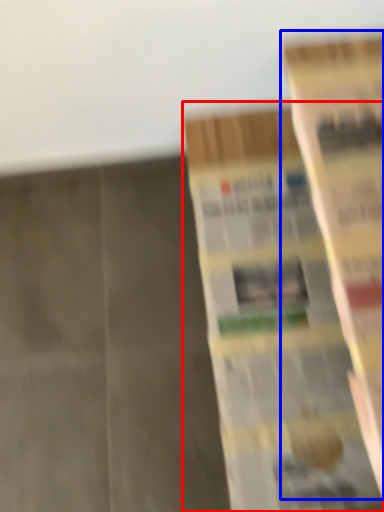
Question: Which object appears farthest to the camera in this image, book (highlighted by a red box) or book (highlighted by a blue box)?

Choices:
 (A) book
 (B) book

Answer: (A)